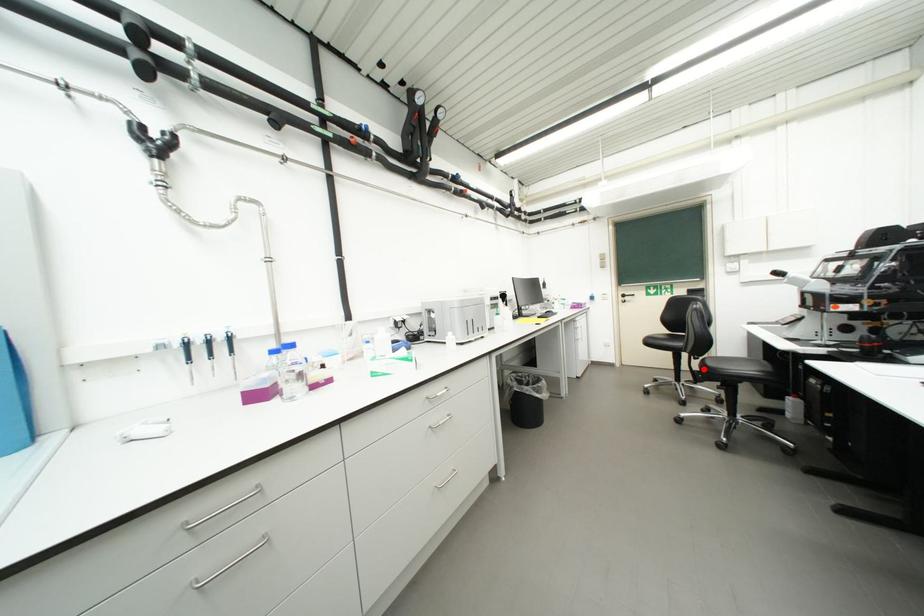
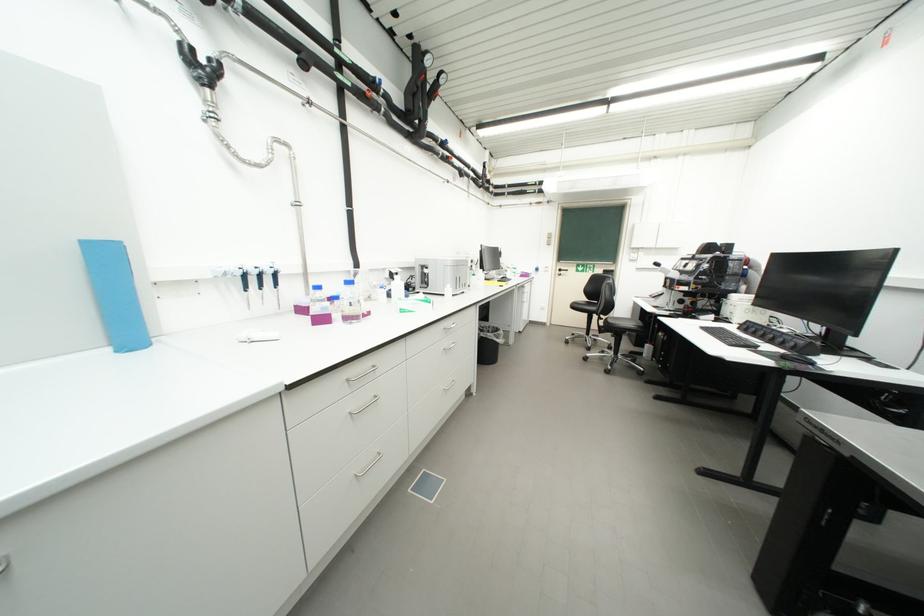
Question: I am providing you with two images of the same scene from different viewpoints. In image1, a red point is highlighted. Considering the same 3D point in image2, which of the following is correct?

Choices:
 (A) It is closer
 (B) It is farther

Answer: (B)